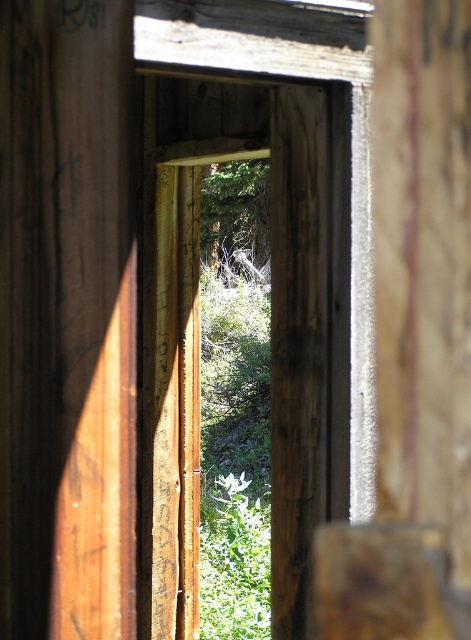
You are standing in a room with a partially open wooden door or window frame. There is a point marked at coordinates (268, 268). Where is this point located in relation to the weathered wood frame?

The point at (268, 268) marks the center of the weathered wood frame.

You are standing in a room and looking through the weathered wood frame at center. You notice a green leafy tree at center outside. Which object is more to the left?

Result: The weathered wood frame at center is positioned on the left side of green leafy tree at center, so it is more to the left.

You are an interior designer assessing the space. The weathered wood frame at center and the green leafy tree at center are both visible through the opening. Which object takes up more visual space in the scene?

The weathered wood frame at center has a larger size compared to the green leafy tree at center, so it occupies more visual space in the scene.